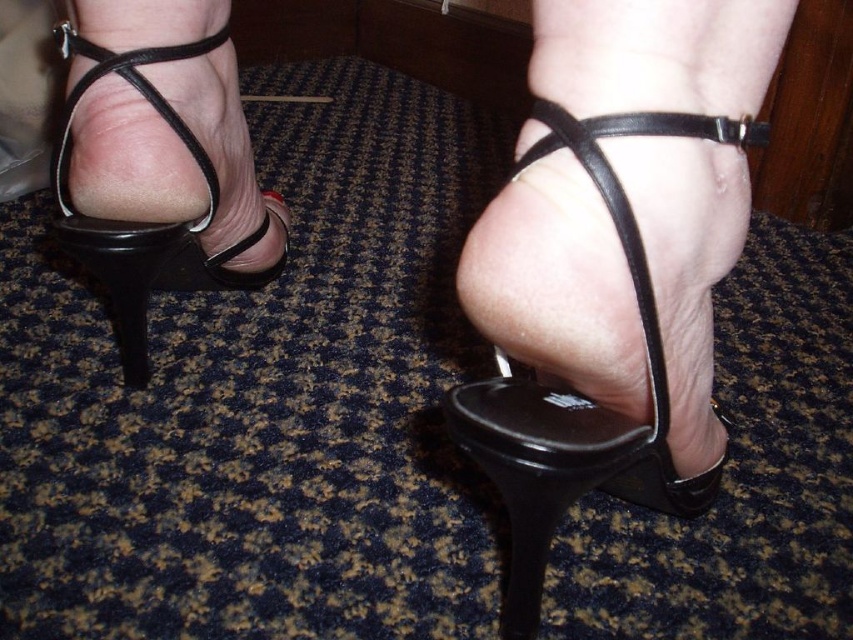
You are standing in a room with the two sandals in front of you. Which sandal would you need to bend down lower to pick up, the matte black sandal at center or the black leather sandal at left?

The matte black sandal at center is closer to the viewer than the black leather sandal at left, so you would need to bend down lower to pick up the matte black sandal at center.

You are a shoe designer evaluating two sandals in the image. The matte black sandal at center and the black leather sandal at left. Which one has a shorter heel?

The matte black sandal at center has a lesser height compared to the black leather sandal at left, so the matte black sandal at center has the shorter heel.